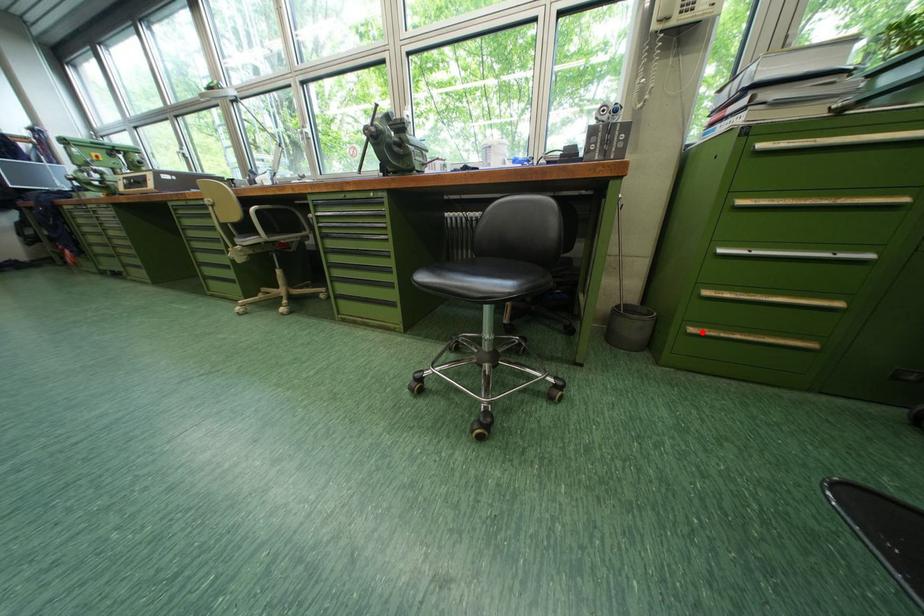
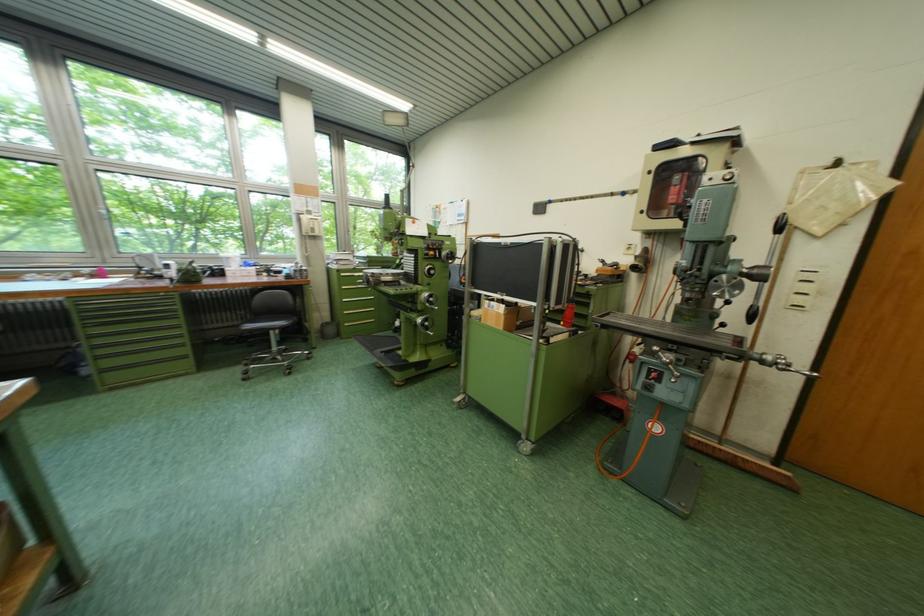
Question: I am providing you with two images of the same scene from different viewpoints. In image1, a red point is highlighted. Considering the same 3D point in image2, which of the following is correct?

Choices:
 (A) It is closer
 (B) It is farther

Answer: (B)